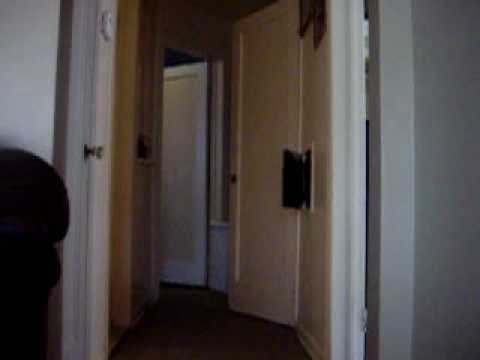
This screenshot has width=480, height=360. I want to click on wall, so click(x=138, y=221).